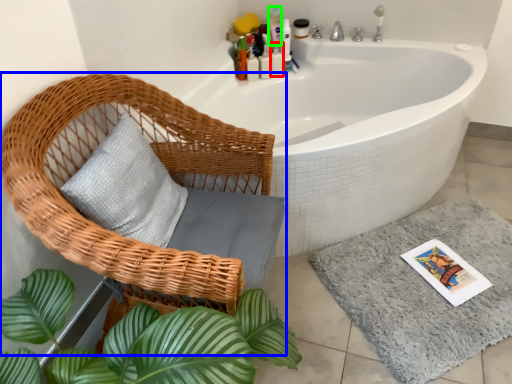
Question: Which object is the closest to the toiletry (highlighted by a red box)? Choose among these: chair (highlighted by a blue box) or toiletry (highlighted by a green box).

Choices:
 (A) chair
 (B) toiletry

Answer: (B)